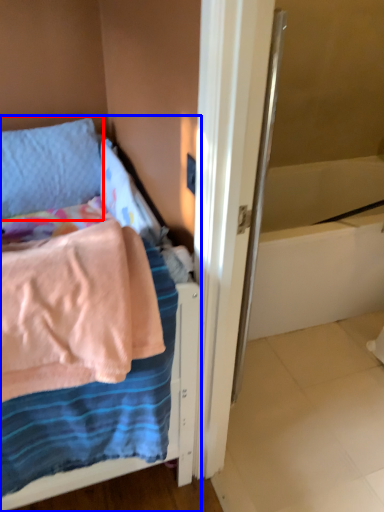
Question: Among these objects, which one is farthest to the camera, pillow (highlighted by a red box) or bed (highlighted by a blue box)?

Choices:
 (A) pillow
 (B) bed

Answer: (A)